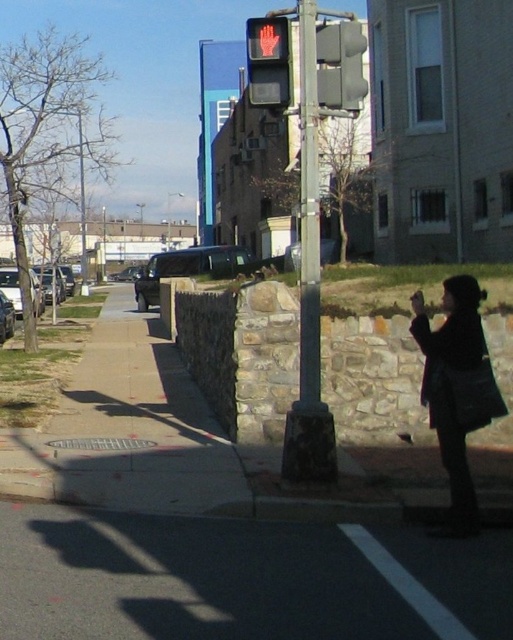
You are a delivery driver who needs to park your shiny black suv at center as close as possible to the gray matte traffic light at upper center. According to the image, what is the closest distance you can get your suv to the traffic light?

The gray matte traffic light at upper center is 16.67 meters away from the shiny black suv at center, so the closest distance you can get your suv to the traffic light is 16.67 meters.

Based on the photo, you are standing at the point with coordinates (267, 61) in the image. Based on the scene description, what object are you directly facing?

The point at coordinates (267, 61) corresponds to the red matte pedestrian signal at upper center, so you are directly facing the red matte pedestrian signal at upper center.

You are a delivery driver approaching the intersection with the gray matte traffic light at upper center and the shiny black suv at center. Which object is nearer to your current position?

The gray matte traffic light at upper center is closer to the viewer than the shiny black suv at center, so the traffic light is nearer to your current position.